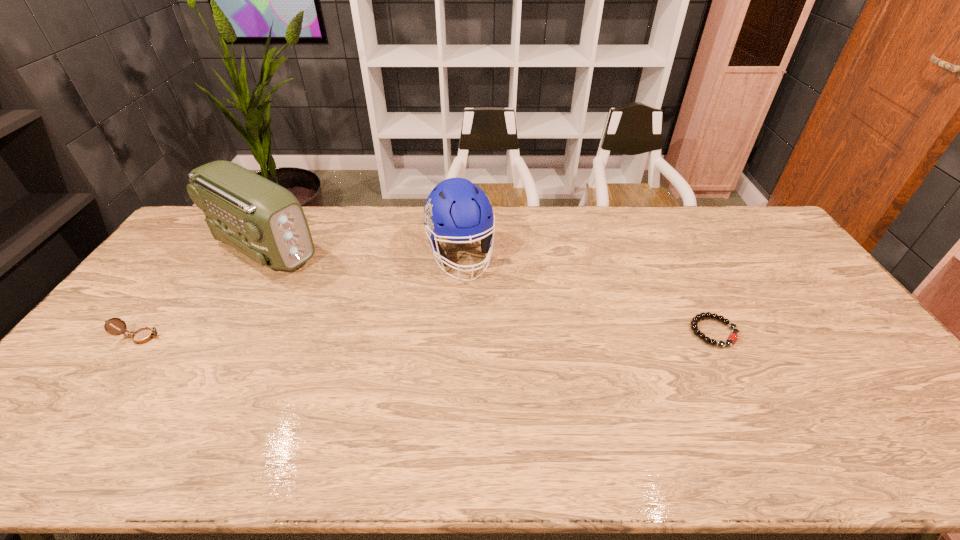
Find the location of `compass`. compass is located at coordinates (143, 335).

What are the coordinates of `the rightmost object` in the screenshot? It's located at (732, 338).

Locate an element on the screen. This screenshot has width=960, height=540. the shortest object is located at coordinates (732, 338).

At what (x,y) coordinates should I click in order to perform the action: click on the second object from right to left. Please return your answer as a coordinate pair (x, y). Looking at the image, I should click on (456, 209).

Where is `radio_receiver`? This screenshot has width=960, height=540. radio_receiver is located at coordinates (264, 221).

Where is `free space located 0.080m on the face of the third tallest object`? This screenshot has height=540, width=960. free space located 0.080m on the face of the third tallest object is located at coordinates (191, 338).

The width and height of the screenshot is (960, 540). Identify the location of free region located on the left of the bracelet. (599, 332).

Identify the location of vacant space located on the face guard of the football helmet. The width and height of the screenshot is (960, 540). (473, 299).

Find the location of a particular element. vacant space positioned on the face guard of the football helmet is located at coordinates (497, 363).

Identify the location of vacant region located 0.340m on the face guard of the football helmet. The width and height of the screenshot is (960, 540). (500, 372).